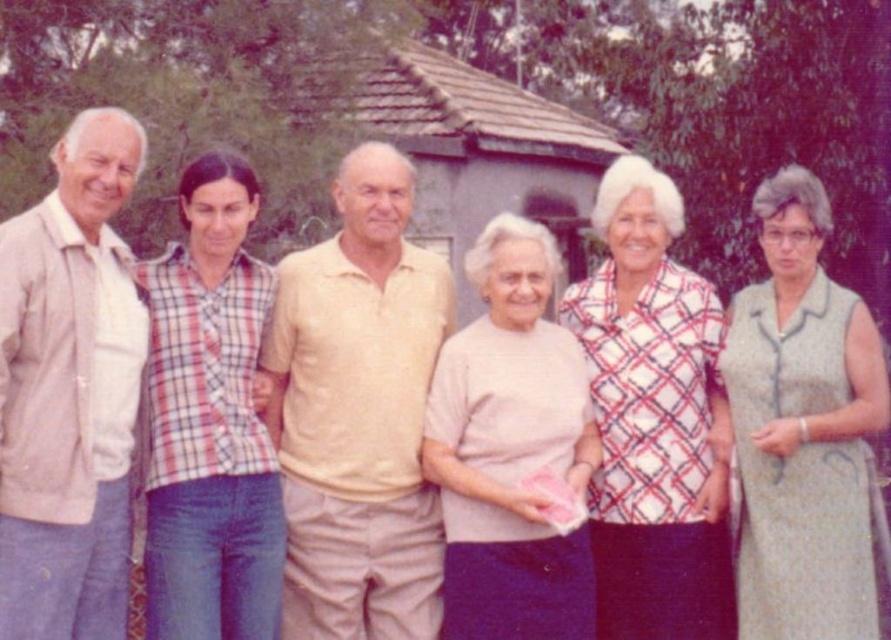
Question: Which of the following is the closest to the observer?

Choices:
 (A) tap(360, 310)
 (B) tap(677, 205)
 (C) tap(469, 616)

Answer: (C)

Question: Estimate the real-world distances between objects in this image. Which object is farther from the light gray textured dress at center right?

Choices:
 (A) beige cotton jacket at left
 (B) plaid cotton shirt at center
 (C) light beige cotton shirt at center
 (D) plaid fabric blouse at center

Answer: (A)

Question: Is light gray textured dress at center right closer to the viewer compared to plaid fabric blouse at center?

Choices:
 (A) no
 (B) yes

Answer: (B)

Question: Which point is closer to the camera?

Choices:
 (A) (189, 396)
 (B) (638, 624)
 (C) (805, 282)

Answer: (A)

Question: Is light gray textured dress at center right closer to camera compared to plaid fabric blouse at center?

Choices:
 (A) yes
 (B) no

Answer: (A)

Question: Is plaid fabric blouse at center thinner than light beige cotton shirt at center?

Choices:
 (A) yes
 (B) no

Answer: (A)